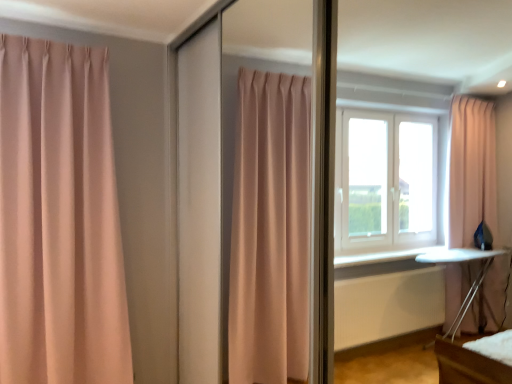
The width and height of the screenshot is (512, 384). What do you see at coordinates (59, 219) in the screenshot?
I see `matte pink curtain at left` at bounding box center [59, 219].

Locate an element on the screen. matte pink curtain at left is located at coordinates (59, 219).

Locate an element on the screen. This screenshot has height=384, width=512. matte pink curtain at left is located at coordinates (59, 219).